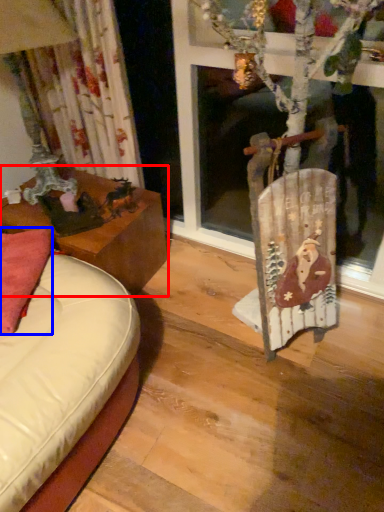
Question: Which point is further to the camera, table (highlighted by a red box) or pillow (highlighted by a blue box)?

Choices:
 (A) table
 (B) pillow

Answer: (A)